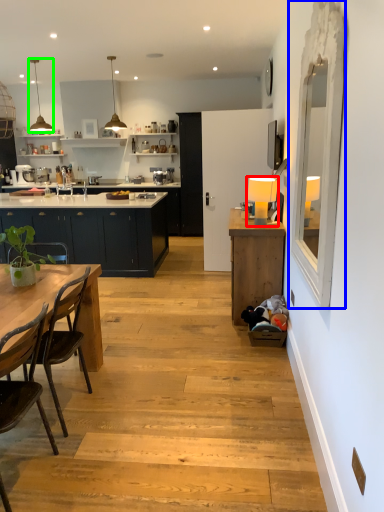
Question: Which object is the closest to the lamp (highlighted by a red box)? Choose among these: glass door (highlighted by a blue box) or lamp (highlighted by a green box).

Choices:
 (A) glass door
 (B) lamp

Answer: (A)